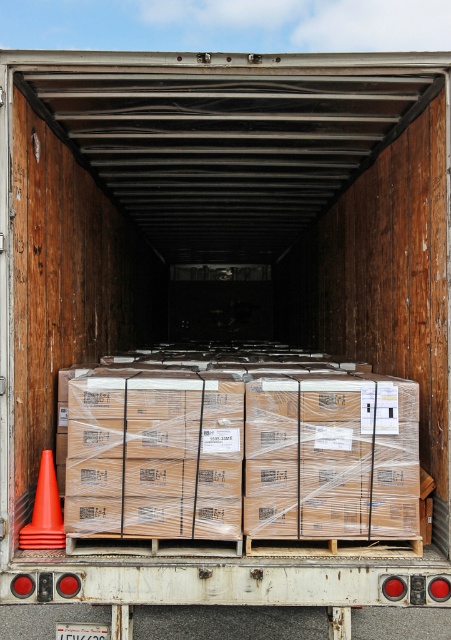
Can you confirm if brown cardboard boxes at center is thinner than orange matte traffic cone at lower left?

In fact, brown cardboard boxes at center might be wider than orange matte traffic cone at lower left.

Between brown cardboard boxes at center and orange matte traffic cone at lower left, which one is positioned higher?

brown cardboard boxes at center

At what (x,y) coordinates should I click in order to perform the action: click on brown cardboard boxes at center. Please return your answer as a coordinate pair (x, y). Image resolution: width=451 pixels, height=640 pixels. Looking at the image, I should click on (240, 449).

Image resolution: width=451 pixels, height=640 pixels. What are the coordinates of `brown cardboard boxes at center` in the screenshot? It's located at (240, 449).